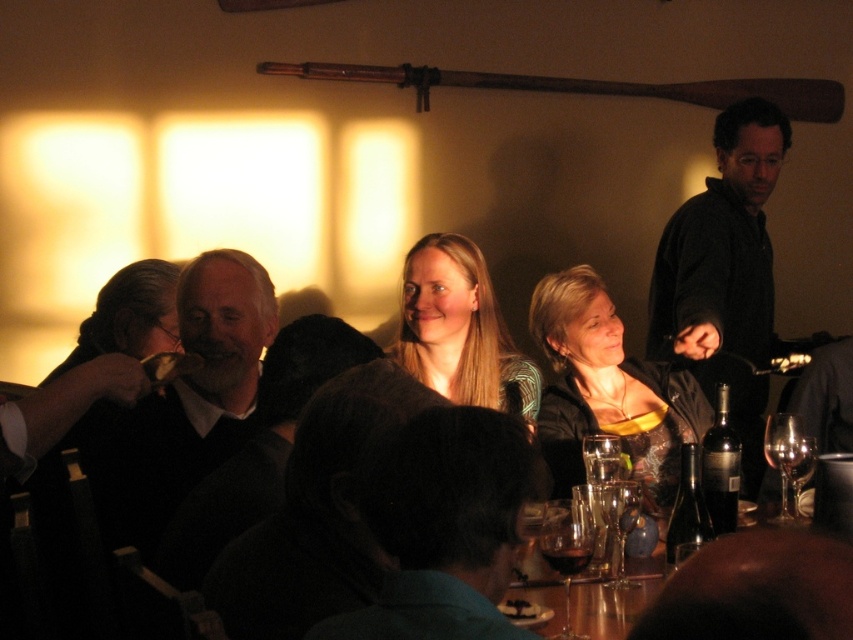
You are a server at the restaurant and need to choose a wine glass for a guest who prefers wide rims for swirling. Which glass should you select between the transparent glass wine at table center and the clear glass wine glass at lower center?

The transparent glass wine at table center has a greater width than the clear glass wine glass at lower center, so you should choose the transparent glass wine at table center for the guest who prefers wide rims for swirling.

You are a guest at the table and want to reach for the clear glass wine glass at lower right. Is the transparent glass wine at table center blocking your path to it?

The transparent glass wine at table center is in front of the clear glass wine glass at lower right, so it is blocking your path to the clear glass wine glass at lower right.

You are a guest at this restaurant and want to sit at the wooden table at lower center. The dark blue shirt at center is currently sitting there. Can you ask them to move?

The dark blue shirt at center is thinner than the wooden table at lower center, so they can likely move to another seat without disturbing the table.